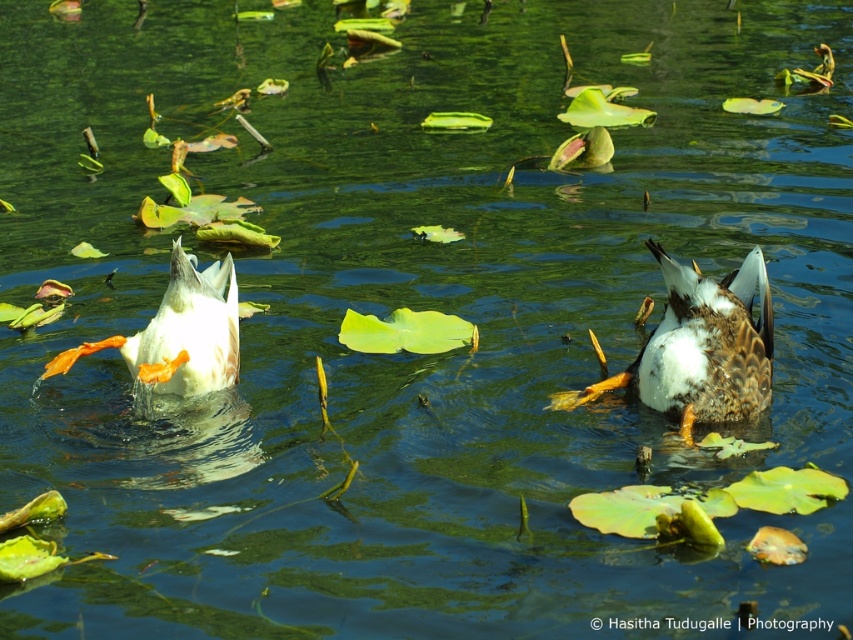
Question: Does brown speckled duck at center appear over white matte duck at left?

Choices:
 (A) no
 (B) yes

Answer: (A)

Question: Which of the following is the closest to the observer?

Choices:
 (A) white matte duck at left
 (B) brown speckled duck at center

Answer: (B)

Question: Which point appears closest to the camera in this image?

Choices:
 (A) (227, 332)
 (B) (645, 356)

Answer: (B)

Question: Observing the image, what is the correct spatial positioning of brown speckled duck at center in reference to white matte duck at left?

Choices:
 (A) below
 (B) above

Answer: (A)

Question: Among these points, which one is farthest from the camera?

Choices:
 (A) (148, 352)
 (B) (656, 252)

Answer: (A)

Question: Considering the relative positions of brown speckled duck at center and white matte duck at left in the image provided, where is brown speckled duck at center located with respect to white matte duck at left?

Choices:
 (A) below
 (B) above

Answer: (A)